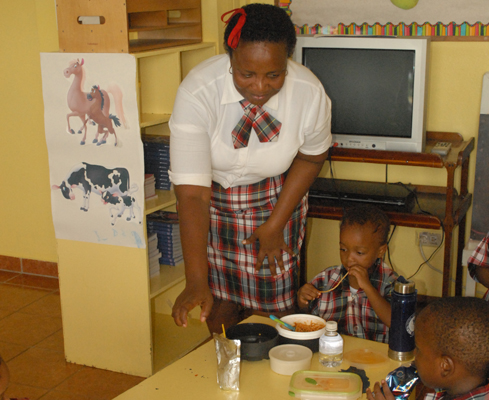
At what (x,y) coordinates should I click in order to perform the action: click on white bowl. Please return your answer as a coordinate pair (x, y). The image size is (489, 400). Looking at the image, I should click on (313, 337).